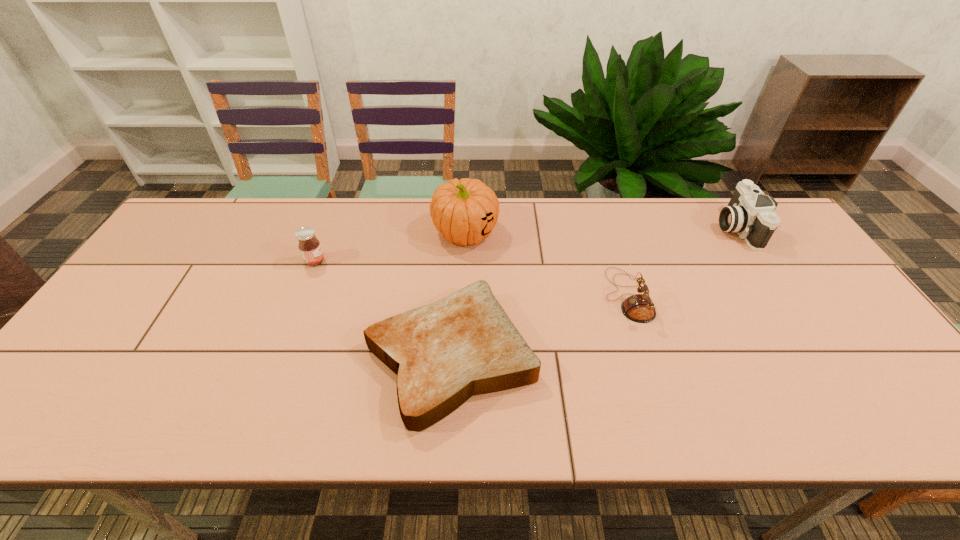
Identify the location of the tallest object. The height and width of the screenshot is (540, 960). (465, 211).

The image size is (960, 540). I want to click on the rightmost object, so click(x=750, y=213).

I want to click on camera, so click(x=750, y=213).

You are a GUI agent. You are given a task and a screenshot of the screen. Output one action in this format:
    pyautogui.click(x=<x>, y=<y>)
    Task: Click on the leftmost object
    This screenshot has width=960, height=540.
    Given the screenshot: What is the action you would take?
    pyautogui.click(x=310, y=248)

Where is `the third tallest object`? the third tallest object is located at coordinates (310, 248).

You are a GUI agent. You are given a task and a screenshot of the screen. Output one action in this format:
    pyautogui.click(x=<x>, y=<y>)
    Task: Click on the telephone
    The height and width of the screenshot is (540, 960).
    Given the screenshot: What is the action you would take?
    pyautogui.click(x=639, y=308)

You are a GUI agent. You are given a task and a screenshot of the screen. Output one action in this format:
    pyautogui.click(x=<x>, y=<y>)
    Task: Click on the second object from right to left
    This screenshot has width=960, height=540.
    Given the screenshot: What is the action you would take?
    pyautogui.click(x=639, y=308)

Find the location of `bread`. bread is located at coordinates (443, 353).

The image size is (960, 540). What are the coordinates of `vacant space located on the surface of the tallest object` in the screenshot? It's located at (461, 354).

Locate an element on the screen. The height and width of the screenshot is (540, 960). vacant space located on the front of the rightmost object is located at coordinates (779, 292).